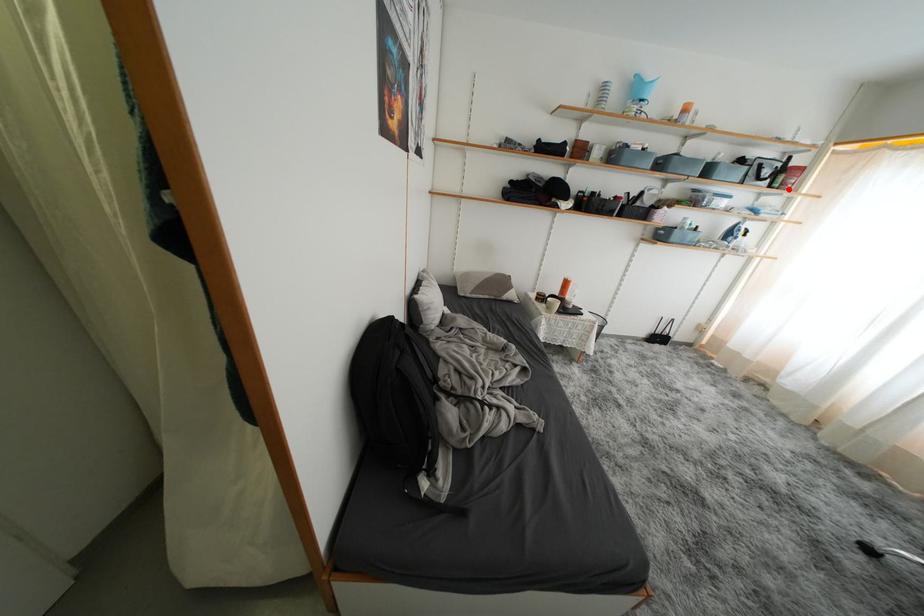
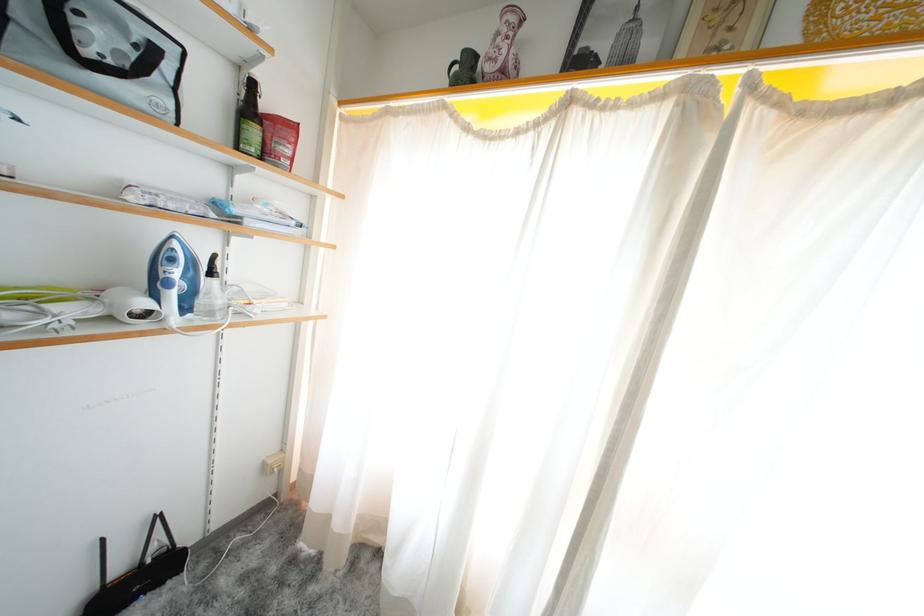
The point at the highlighted location is marked in the first image. Where is the corresponding point in the second image?

(273, 158)